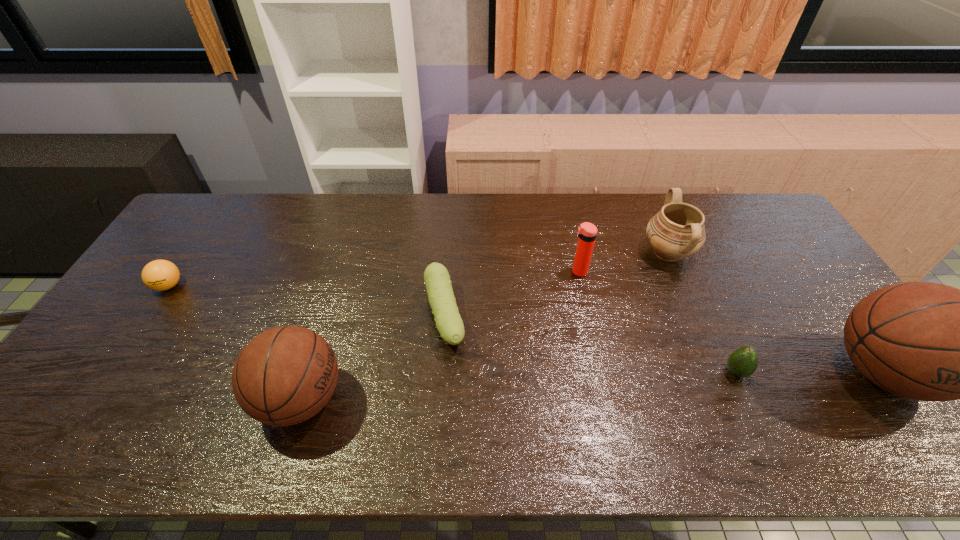
Where is `the shorter basketball`? the shorter basketball is located at coordinates (285, 375).

Where is `the left basketball`? The image size is (960, 540). the left basketball is located at coordinates (285, 375).

Identify the location of the leftmost object. The image size is (960, 540). (160, 275).

The width and height of the screenshot is (960, 540). What are the coordinates of `the fifth object from right to left` in the screenshot? It's located at (448, 321).

This screenshot has width=960, height=540. I want to click on the fourth object from right to left, so click(x=587, y=232).

Where is `avocado`? This screenshot has width=960, height=540. avocado is located at coordinates (743, 362).

The width and height of the screenshot is (960, 540). What are the coordinates of `urn` in the screenshot? It's located at (677, 231).

Where is `free space located on the side with brand label of the left basketball`? Image resolution: width=960 pixels, height=540 pixels. free space located on the side with brand label of the left basketball is located at coordinates (506, 399).

Locate an element on the screen. Image resolution: width=960 pixels, height=540 pixels. vacant space located on the side with brand of the ping-pong ball is located at coordinates (139, 330).

The image size is (960, 540). In order to click on free region located 0.110m on the back of the fifth object from right to left in this screenshot , I will do `click(448, 258)`.